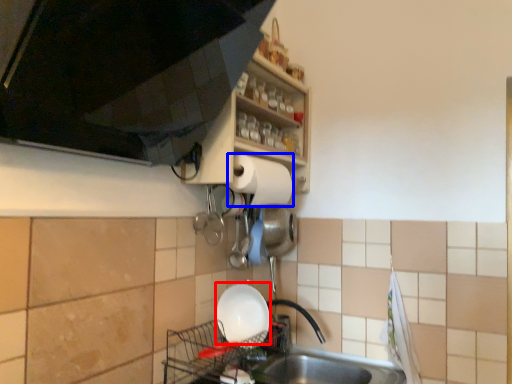
Question: Which object appears closest to the camera in this image, basin (highlighted by a red box) or paper towel (highlighted by a blue box)?

Choices:
 (A) basin
 (B) paper towel

Answer: (A)